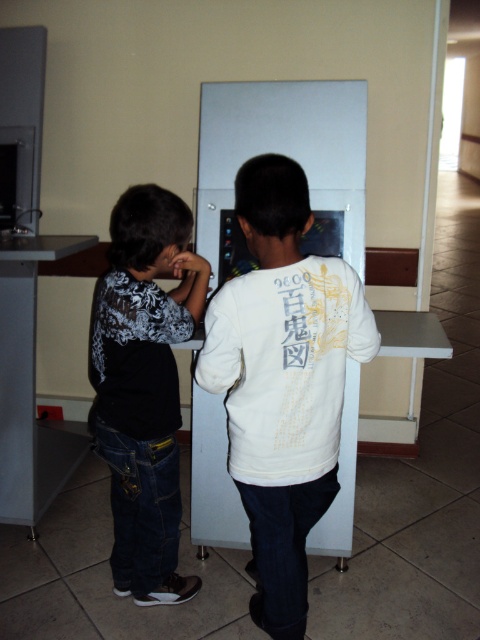
Is white matte sweatshirt at center to the left of black matte shirt at left from the viewer's perspective?

In fact, white matte sweatshirt at center is to the right of black matte shirt at left.

Can you confirm if white matte sweatshirt at center is wider than black matte shirt at left?

Yes, white matte sweatshirt at center is wider than black matte shirt at left.

Is point (257, 404) farther from camera compared to point (122, 253)?

No.

At what (x,y) coordinates should I click in order to perform the action: click on white matte sweatshirt at center. Please return your answer as a coordinate pair (x, y). Looking at the image, I should click on (283, 380).